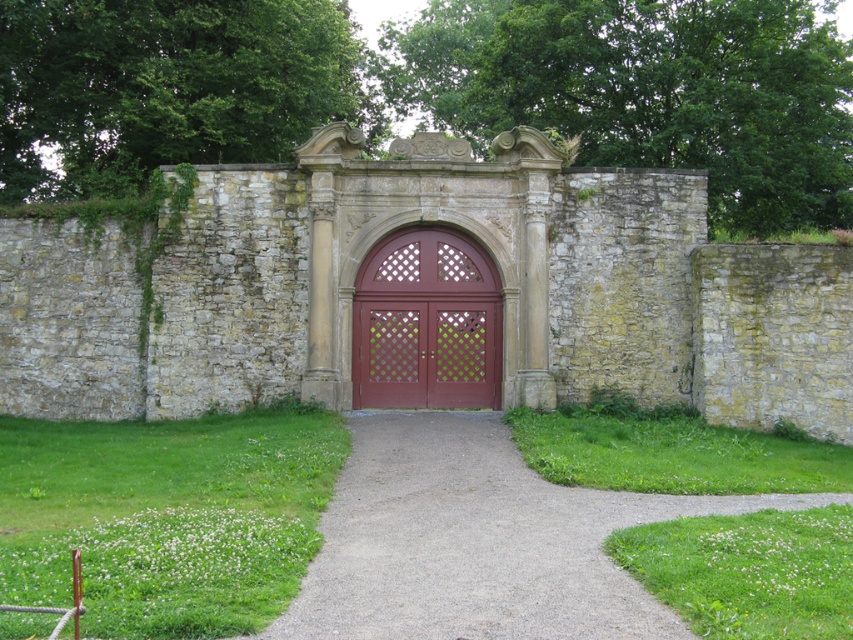
Question: Which point appears closest to the camera in this image?

Choices:
 (A) (410, 536)
 (B) (381, 241)

Answer: (A)

Question: Can you confirm if gravel path at center is positioned above matte wood door at center?

Choices:
 (A) no
 (B) yes

Answer: (A)

Question: Is gravel path at center below matte wood door at center?

Choices:
 (A) yes
 (B) no

Answer: (A)

Question: Does gravel path at center have a lesser width compared to matte wood door at center?

Choices:
 (A) no
 (B) yes

Answer: (A)